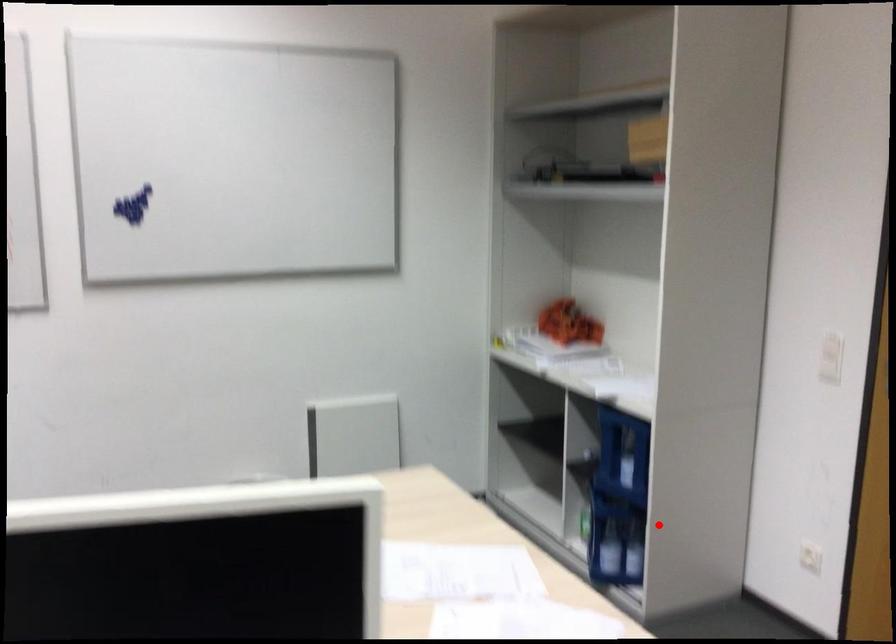
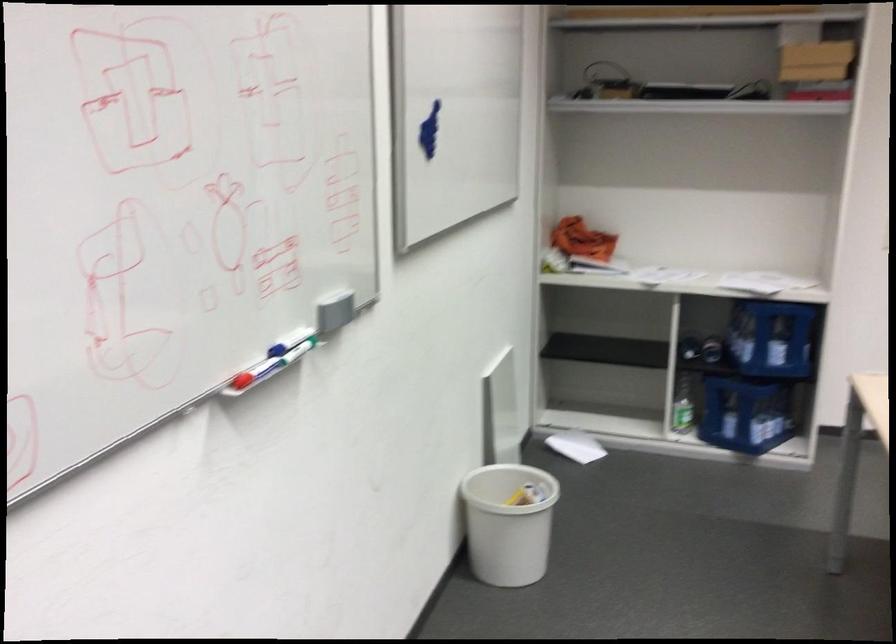
Where in the second image is the point corresponding to the highlighted location from the first image?

(745, 413)